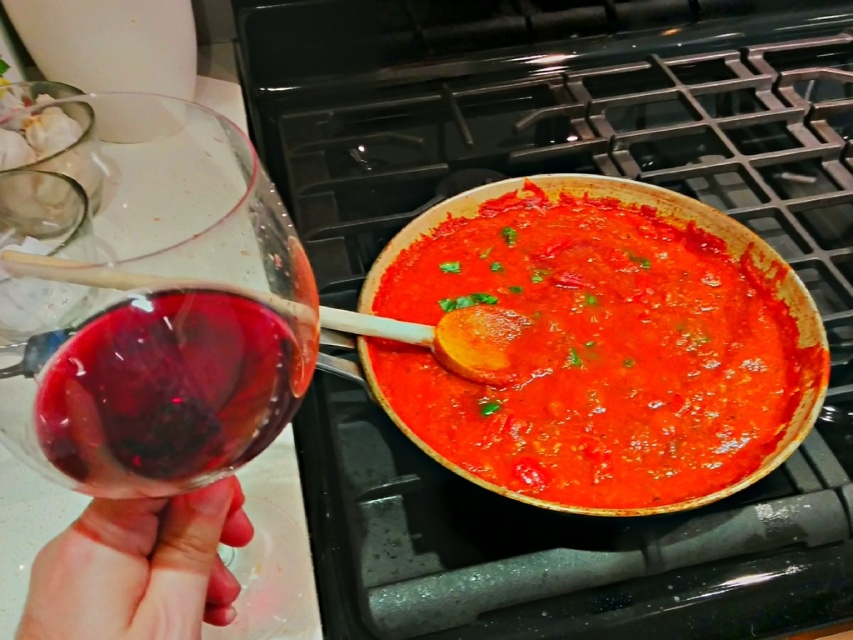
Question: Does transparent glass at left have a larger size compared to smooth skin at lower left?

Choices:
 (A) yes
 (B) no

Answer: (A)

Question: Which of the following is the farthest from the observer?

Choices:
 (A) ruby glass at left
 (B) black matte gas stove at upper center

Answer: (B)

Question: Which of these objects is positioned closest to the ruby glass at left?

Choices:
 (A) smooth skin at lower left
 (B) tomato sauce at center

Answer: (A)

Question: Does black matte gas stove at upper center have a smaller size compared to tomato sauce at center?

Choices:
 (A) no
 (B) yes

Answer: (A)

Question: Does tomato sauce at center have a smaller size compared to ruby glass at left?

Choices:
 (A) no
 (B) yes

Answer: (A)

Question: Which of the following is the closest to the observer?

Choices:
 (A) (241, 428)
 (B) (532, 372)
 (C) (28, 616)

Answer: (C)